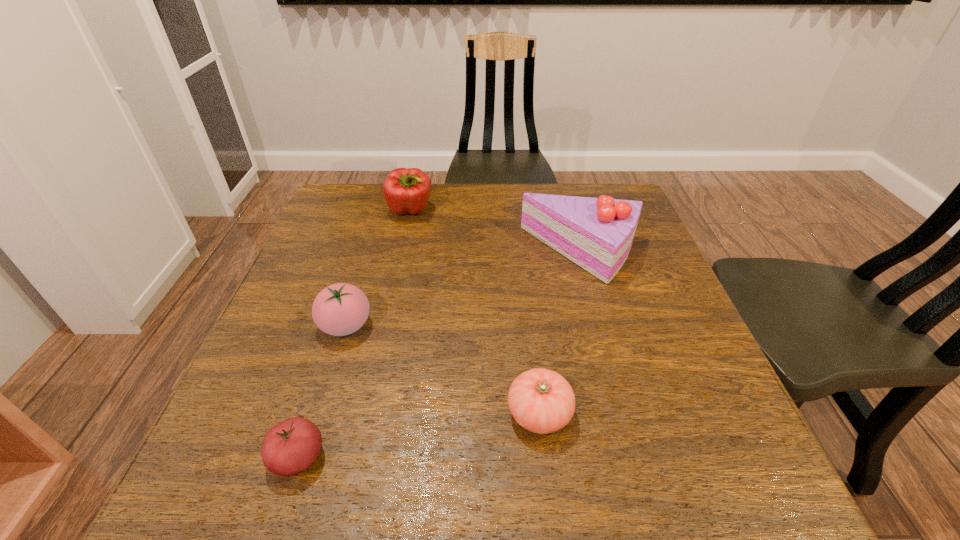
Locate an element on the screen. The width and height of the screenshot is (960, 540). free space between the rightmost tomato and the farthest object is located at coordinates (474, 312).

The image size is (960, 540). In order to click on unoccupied position between the fourth nearest object and the farthest object in this screenshot , I will do `click(496, 232)`.

You are a GUI agent. You are given a task and a screenshot of the screen. Output one action in this format:
    pyautogui.click(x=<x>, y=<y>)
    Task: Click on the empty space between the fourth nearest object and the bell pepper
    
    Given the screenshot: What is the action you would take?
    pyautogui.click(x=496, y=232)

Where is `free space between the second farthest object and the farthest tomato`? free space between the second farthest object and the farthest tomato is located at coordinates (464, 289).

Identify the location of object that is the fourth closest to the rightmost tomato. (406, 190).

Locate an element on the screen. This screenshot has width=960, height=540. object that stands as the fourth closest to the rightmost tomato is located at coordinates (406, 190).

Locate which tomato is the second closest to the cake. Please provide its 2D coordinates. Your answer should be formatted as a tuple, i.e. [(x, y)], where the tuple contains the x and y coordinates of a point satisfying the conditions above.

[(340, 309)]

The width and height of the screenshot is (960, 540). Find the location of `tomato that stands as the closest to the rightmost tomato`. tomato that stands as the closest to the rightmost tomato is located at coordinates (340, 309).

I want to click on vacant area in the image that satisfies the following two spatial constraints: 1. on the front side of the rightmost tomato; 2. on the right side of the bell pepper, so click(366, 414).